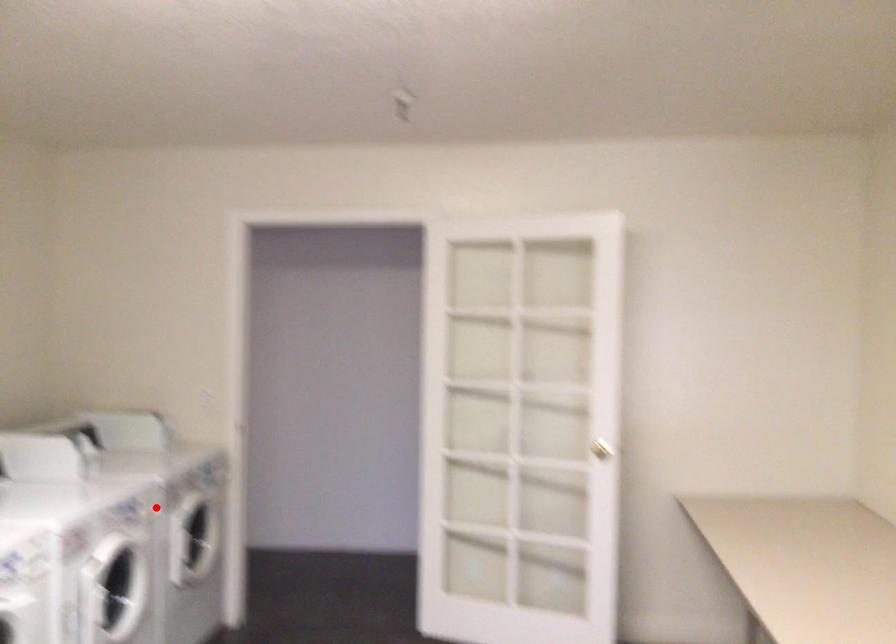
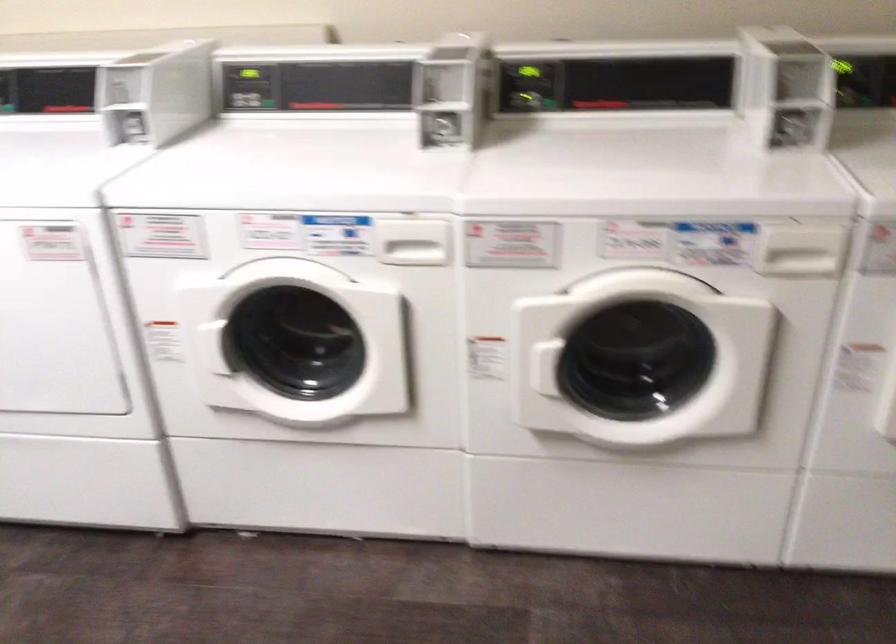
Question: I am providing you with two images of the same scene from different viewpoints. A red point is shown in image1. For the corresponding object point in image2, is it positioned nearer or farther from the camera?

Choices:
 (A) Nearer
 (B) Farther

Answer: (A)